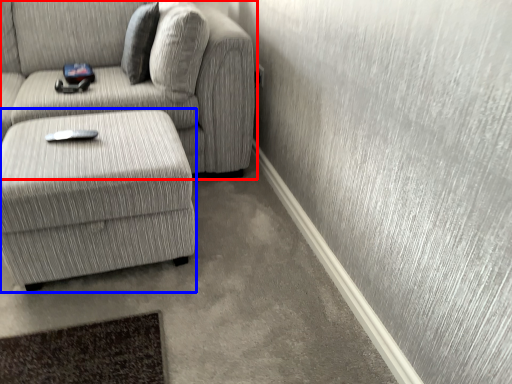
Question: Which point is closer to the camera, studio couch (highlighted by a red box) or table (highlighted by a blue box)?

Choices:
 (A) studio couch
 (B) table

Answer: (B)